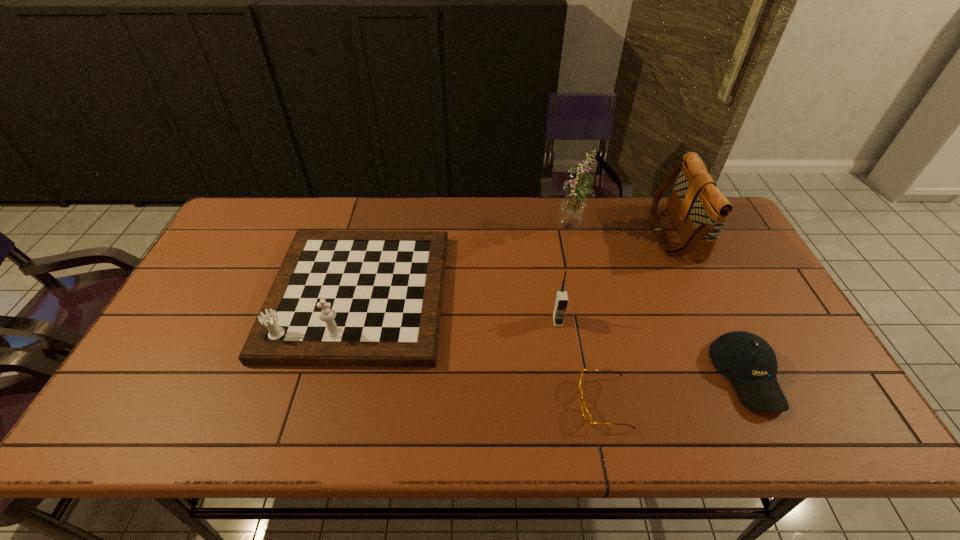
Image resolution: width=960 pixels, height=540 pixels. What are the coordinates of `free space located on the front-facing side of the fifth shortest object` in the screenshot? It's located at (613, 233).

You are a GUI agent. You are given a task and a screenshot of the screen. Output one action in this format:
    pyautogui.click(x=<x>, y=<y>)
    Task: Click on the vacant space located 0.250m on the front-facing side of the fifth shortest object
    The image size is (960, 540).
    Given the screenshot: What is the action you would take?
    pyautogui.click(x=577, y=233)

Identify the location of free space located on the front-facing side of the second object from left to right. This screenshot has width=960, height=540. (567, 383).

Where is `vacant space positioned 0.350m on the right of the gameboard`? vacant space positioned 0.350m on the right of the gameboard is located at coordinates (566, 294).

Locate an element on the screen. The width and height of the screenshot is (960, 540). free location located 0.060m on the front-facing side of the shortest object is located at coordinates (553, 402).

Where is `vacant space located on the front-facing side of the shortest object`? This screenshot has width=960, height=540. vacant space located on the front-facing side of the shortest object is located at coordinates (545, 402).

You are a GUI agent. You are given a task and a screenshot of the screen. Output one action in this format:
    pyautogui.click(x=<x>, y=<y>)
    Task: Click on the vacant space located on the front-facing side of the shortest object
    The width and height of the screenshot is (960, 540).
    Given the screenshot: What is the action you would take?
    pyautogui.click(x=540, y=402)

The width and height of the screenshot is (960, 540). Find the location of `bouquet present at the far edge`. bouquet present at the far edge is located at coordinates (572, 211).

The width and height of the screenshot is (960, 540). I want to click on shoulder bag at the far edge, so click(699, 209).

Where is `gameboard present at the far edge`? The height and width of the screenshot is (540, 960). gameboard present at the far edge is located at coordinates (340, 298).